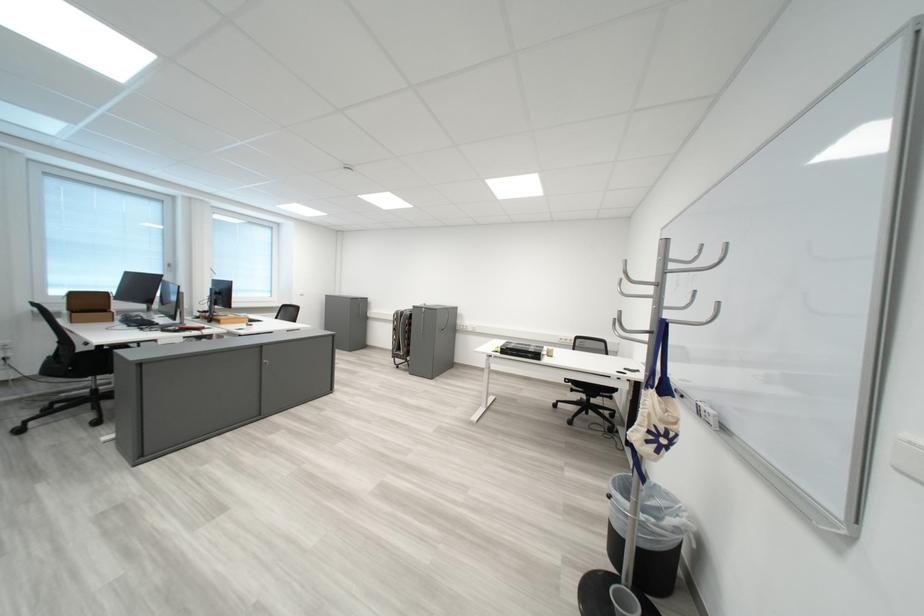
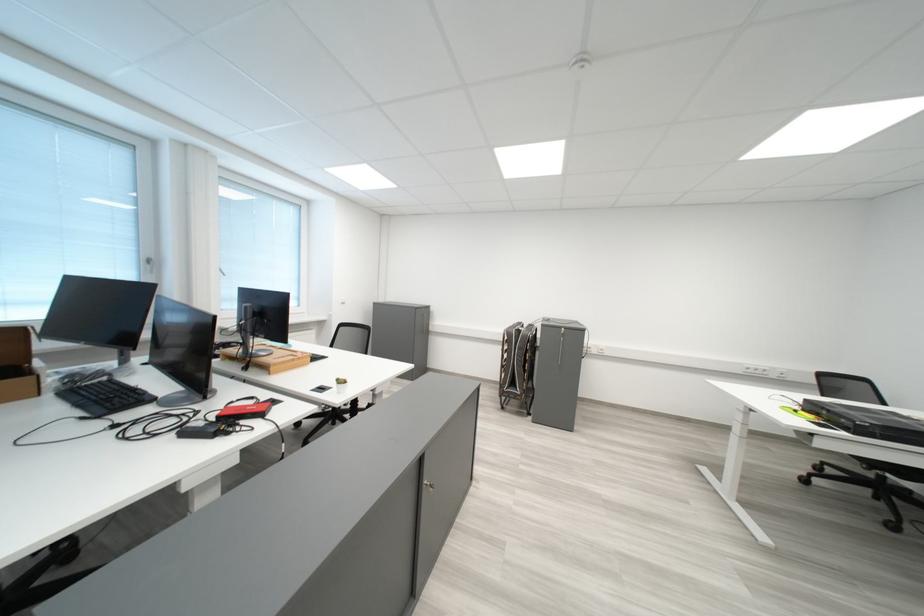
The point at (x=411, y=351) is marked in the first image. Where is the corresponding point in the second image?

(526, 387)